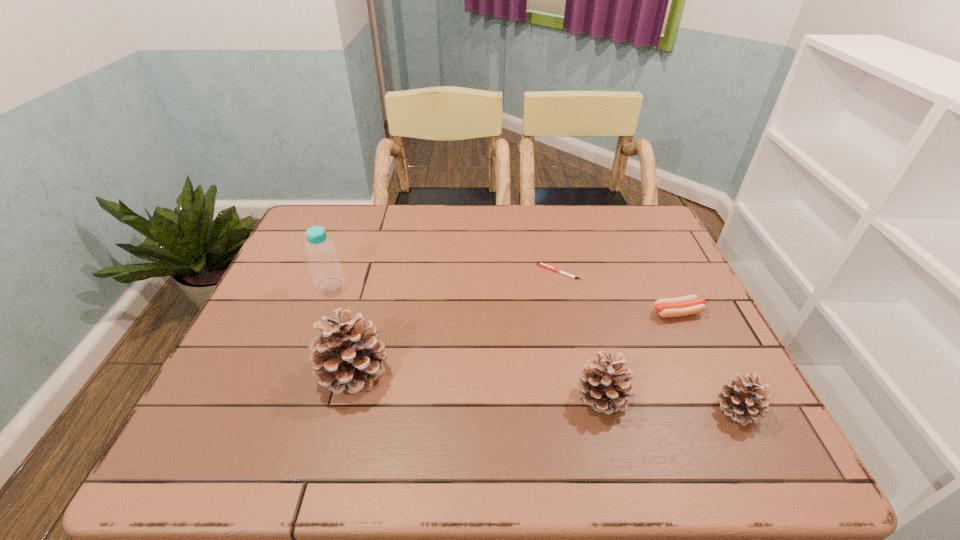
Where is `sausage located in the right edge section of the desktop`? sausage located in the right edge section of the desktop is located at coordinates (687, 305).

You are a GUI agent. You are given a task and a screenshot of the screen. Output one action in this format:
    pyautogui.click(x=<x>, y=<y>)
    Task: Click on the object that is at the near right corner
    
    Given the screenshot: What is the action you would take?
    pyautogui.click(x=742, y=399)

This screenshot has height=540, width=960. Find the location of `blank area at the far edge`. blank area at the far edge is located at coordinates [511, 222].

Locate an element on the screen. The width and height of the screenshot is (960, 540). vacant space at the near edge of the desktop is located at coordinates (484, 402).

Image resolution: width=960 pixels, height=540 pixels. In the image, there is a desktop. In order to click on vacant space at the left edge in this screenshot , I will do `click(281, 273)`.

At what (x,y) coordinates should I click in order to perform the action: click on vacant space at the right edge of the desktop. Please return your answer as a coordinate pair (x, y). The height and width of the screenshot is (540, 960). Looking at the image, I should click on (688, 279).

In order to click on vacant region at the near left corner of the desktop in this screenshot , I will do `click(231, 393)`.

Where is `vacant space at the far right corner of the desktop`? vacant space at the far right corner of the desktop is located at coordinates (645, 228).

Where is `free spot between the third shortest object and the bottle`? free spot between the third shortest object and the bottle is located at coordinates (534, 347).

You are a GUI agent. You are given a task and a screenshot of the screen. Output one action in this format:
    pyautogui.click(x=<x>, y=<y>)
    Task: Click on the free space between the fifth object from right to left and the shortest object
    The height and width of the screenshot is (540, 960).
    Given the screenshot: What is the action you would take?
    pyautogui.click(x=456, y=322)